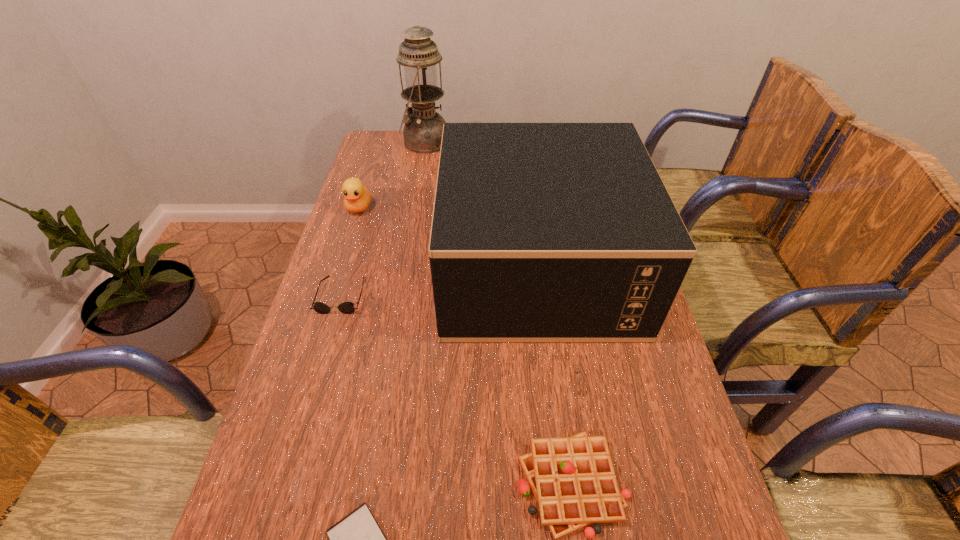
At what (x,y) coordinates should I click in order to perform the action: click on blank space located on the front-facing side of the sunglasses. Please return your answer as a coordinate pair (x, y). This screenshot has width=960, height=540. Looking at the image, I should click on (311, 400).

Where is `object that is at the far edge`? object that is at the far edge is located at coordinates (423, 128).

Locate an element on the screen. This screenshot has height=540, width=960. oil lamp present at the left edge is located at coordinates (423, 128).

Where is `duckling situated at the left edge`? duckling situated at the left edge is located at coordinates (357, 198).

This screenshot has width=960, height=540. I want to click on sunglasses situated at the left edge, so click(346, 307).

Identify the location of object that is at the right edge. (541, 232).

What are the coordinates of `object present at the far left corner` in the screenshot? It's located at (423, 128).

You are a GUI agent. You are given a task and a screenshot of the screen. Output one action in this format:
    pyautogui.click(x=<x>, y=<y>)
    Task: Click on the free region at the left edge
    The width and height of the screenshot is (960, 540).
    Given the screenshot: What is the action you would take?
    pyautogui.click(x=381, y=222)

Where is `free region at the right edge of the desktop`? free region at the right edge of the desktop is located at coordinates (603, 375).

Where is `vacant region at the far left corner of the desktop`? The width and height of the screenshot is (960, 540). vacant region at the far left corner of the desktop is located at coordinates (368, 153).